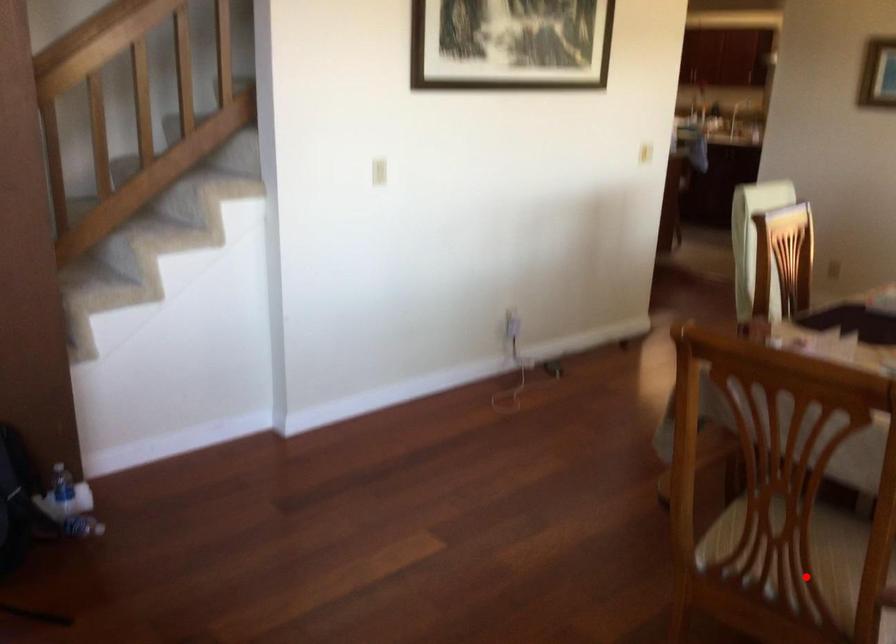
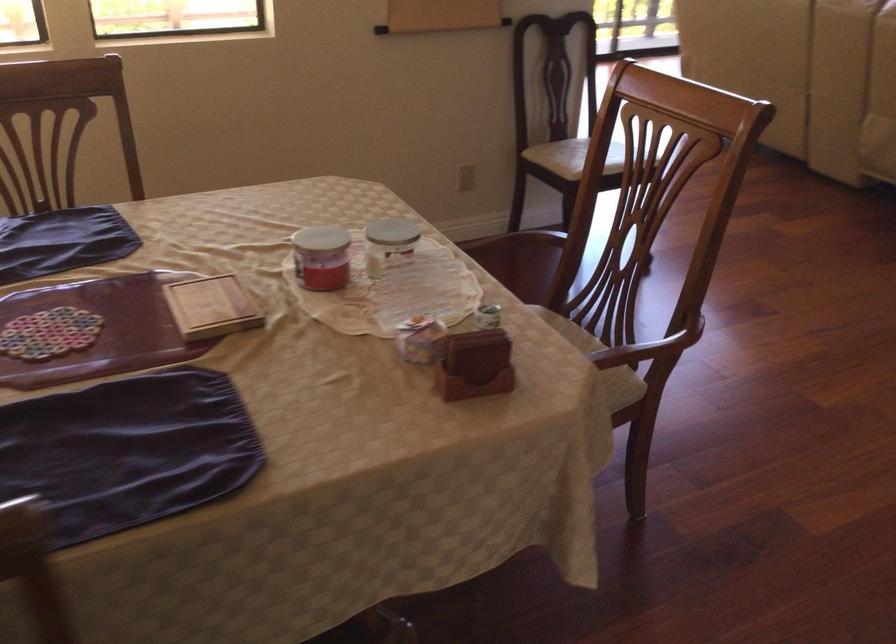
Question: A red point is marked in image1. In image2, is the corresponding 3D point closer to the camera or farther? Reply with the corresponding letter.

Choices:
 (A) The corresponding 3D point is closer.
 (B) The corresponding 3D point is farther.

Answer: (B)